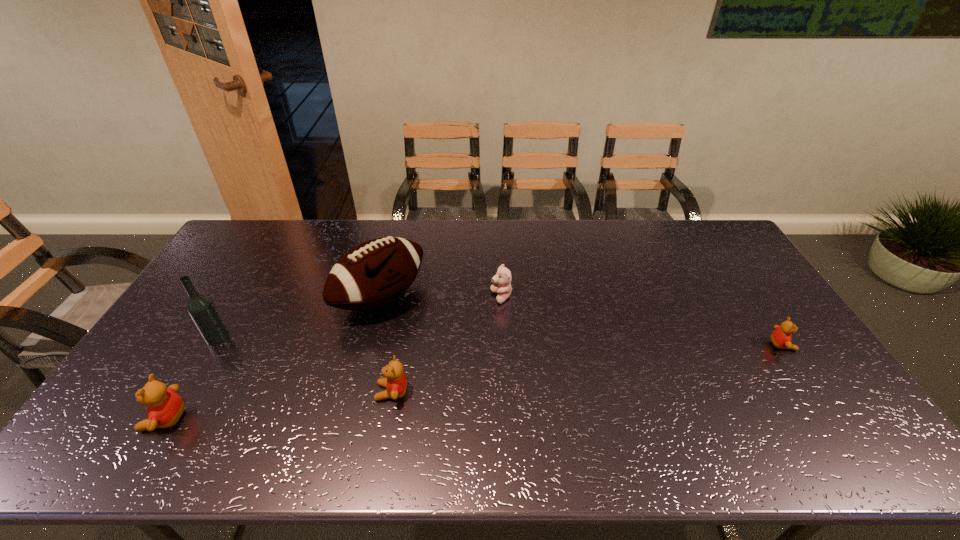
Identify the location of object that is at the near left corner. The width and height of the screenshot is (960, 540). (164, 407).

Locate an element on the screen. Image resolution: width=960 pixels, height=540 pixels. vacant space at the far edge of the desktop is located at coordinates (341, 251).

You are a GUI agent. You are given a task and a screenshot of the screen. Output one action in this format:
    pyautogui.click(x=<x>, y=<y>)
    Task: Click on the vacant space at the near edge of the desktop
    This screenshot has height=540, width=960.
    Given the screenshot: What is the action you would take?
    pyautogui.click(x=409, y=412)

Image resolution: width=960 pixels, height=540 pixels. In the image, there is a desktop. In order to click on vacant space at the left edge in this screenshot , I will do `click(194, 350)`.

Locate an element on the screen. The image size is (960, 540). blank space at the far left corner of the desktop is located at coordinates pos(268,253).

The image size is (960, 540). What are the coordinates of `free spot between the vodka and the football (American)` in the screenshot? It's located at pyautogui.click(x=300, y=319).

The width and height of the screenshot is (960, 540). I want to click on vacant area between the fifth object from left to right and the fourth shortest object, so click(x=333, y=358).

Locate an element on the screen. The height and width of the screenshot is (540, 960). free area in between the leftmost teddy bear and the third teddy bear from right to left is located at coordinates (278, 406).

Find the location of a particular element. This screenshot has height=540, width=960. empty location between the second teddy bear from right to left and the football (American) is located at coordinates (441, 298).

The height and width of the screenshot is (540, 960). In order to click on vacant point located between the second farthest teddy bear and the vodka in this screenshot , I will do `click(500, 342)`.